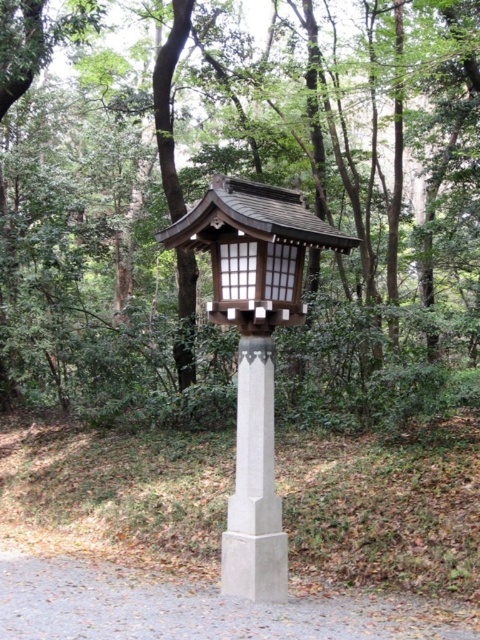
You are an artist planning to paint the scene. You want to ensure the proportions between the green leafy tree at center and the matte wood lantern at center are accurate. Which object should you depict as taller?

The green leafy tree at center should be depicted as taller than the matte wood lantern at center since it has a greater height compared to the lantern.

You are standing in the forest and see the green leafy tree at center and the matte wood lantern at center. Which object is positioned to the left side?

The green leafy tree at center is positioned to the left of the matte wood lantern at center.